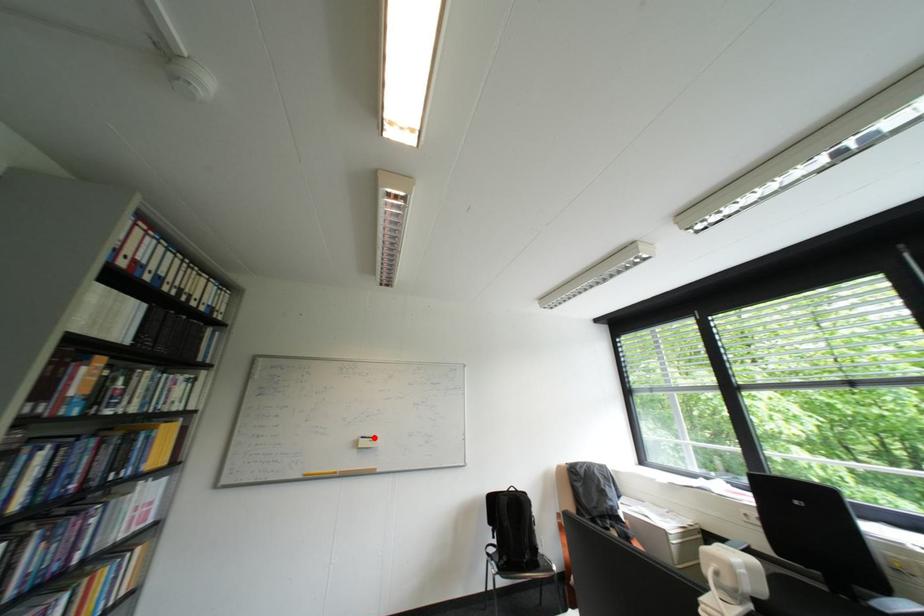
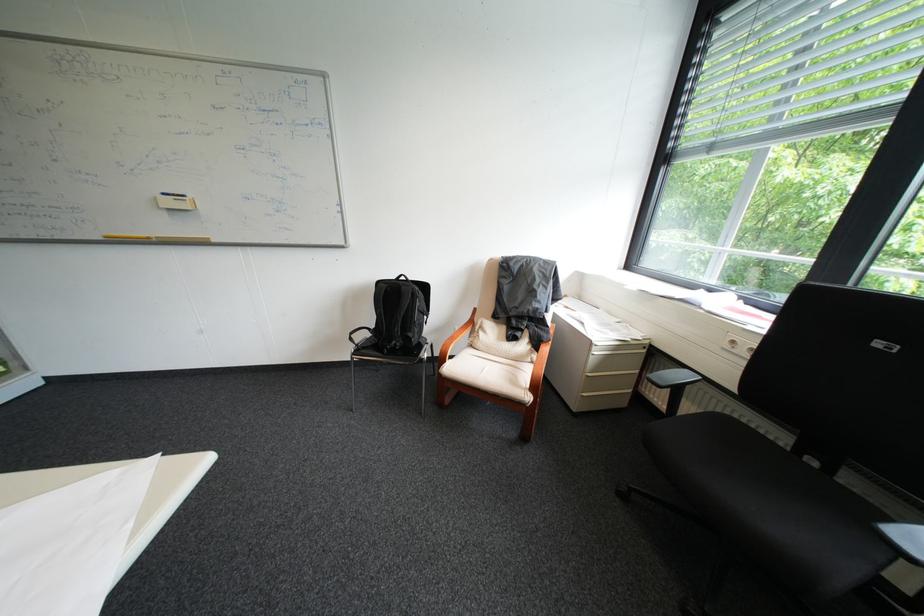
Question: I am providing you with two images of the same scene from different viewpoints. In image1, a red point is highlighted. Considering the same 3D point in image2, which of the following is correct?

Choices:
 (A) It is closer
 (B) It is farther

Answer: (A)